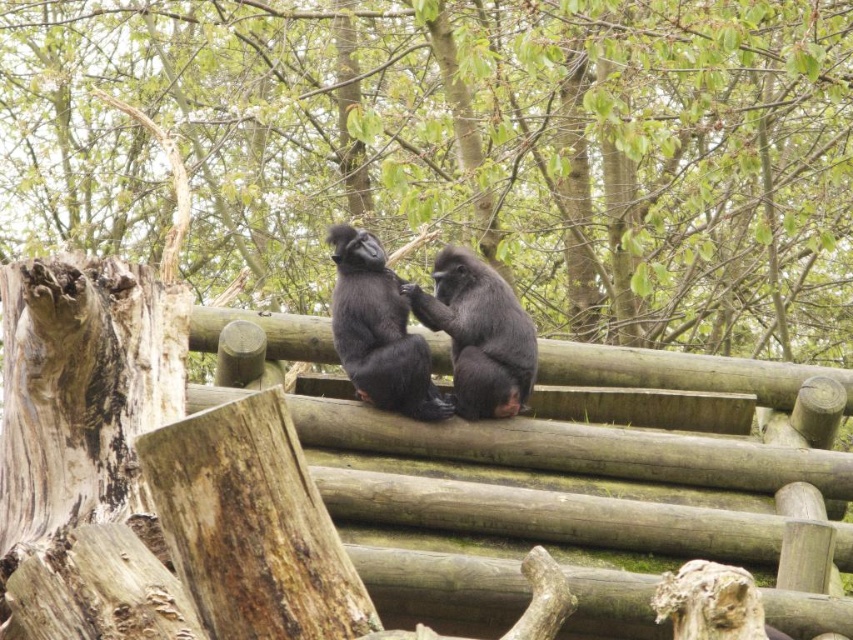
Which is more to the right, smooth bark tree trunk at left or black fur monkey at center?

black fur monkey at center

Between point (659, 22) and point (340, 316), which one is positioned behind?

The point (659, 22) is more distant.

Does point (779, 97) come in front of point (358, 384)?

No, it is behind (358, 384).

The height and width of the screenshot is (640, 853). I want to click on smooth bark tree trunk at left, so pos(460,150).

What do you see at coordinates (479, 333) in the screenshot? I see `shiny black monkey at center` at bounding box center [479, 333].

Which is more to the right, shiny black monkey at center or black fur monkey at center?

From the viewer's perspective, shiny black monkey at center appears more on the right side.

I want to click on shiny black monkey at center, so click(479, 333).

Does smooth bark tree trunk at left appear under shiny black monkey at center?

Incorrect, smooth bark tree trunk at left is not positioned below shiny black monkey at center.

Between smooth bark tree trunk at left and shiny black monkey at center, which one is positioned lower?

Positioned lower is shiny black monkey at center.

This screenshot has height=640, width=853. What do you see at coordinates (460, 150) in the screenshot?
I see `smooth bark tree trunk at left` at bounding box center [460, 150].

You are a GUI agent. You are given a task and a screenshot of the screen. Output one action in this format:
    pyautogui.click(x=<x>, y=<y>)
    Task: Click on the smooth bark tree trunk at left
    This screenshot has height=640, width=853.
    Given the screenshot: What is the action you would take?
    pyautogui.click(x=460, y=150)